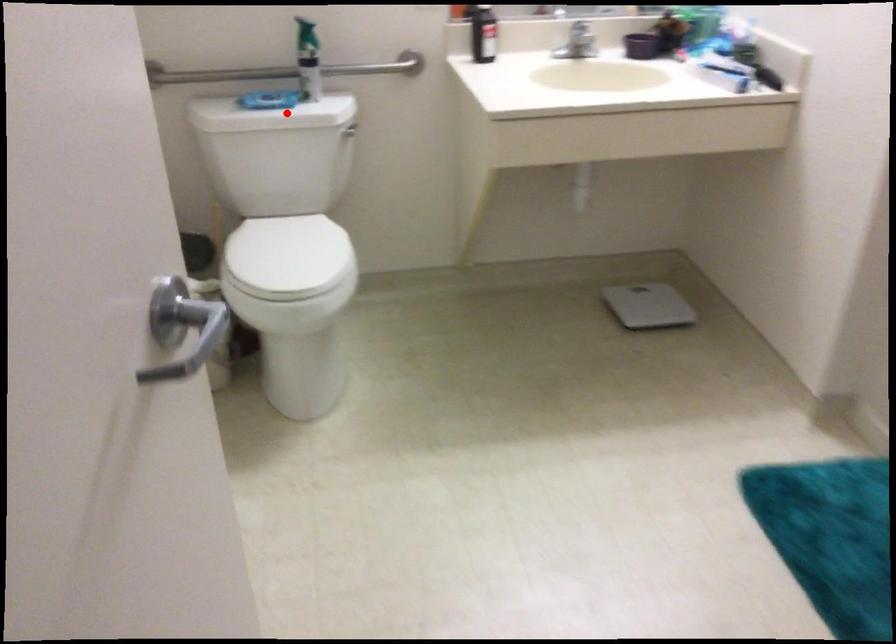
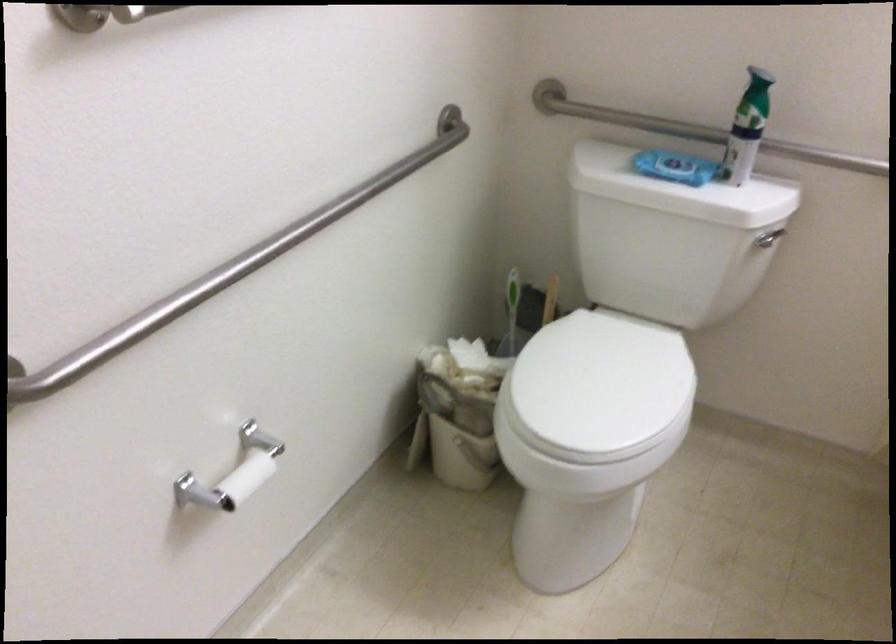
Locate, in the second image, the point that corresponds to the highlighted location in the first image.

(678, 190)